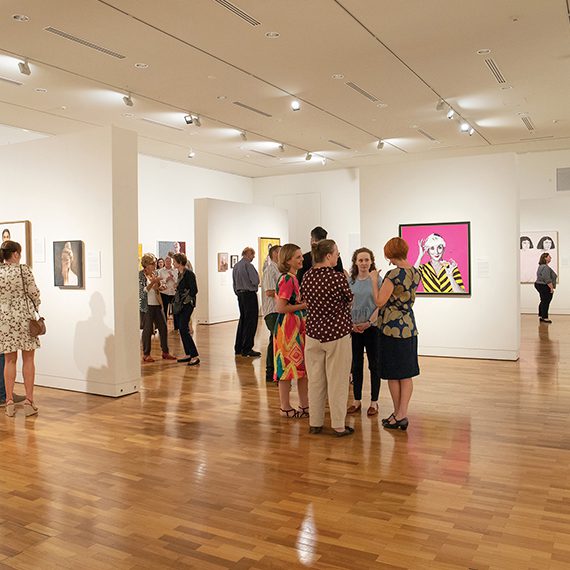
I want to click on wall, so click(x=468, y=194).